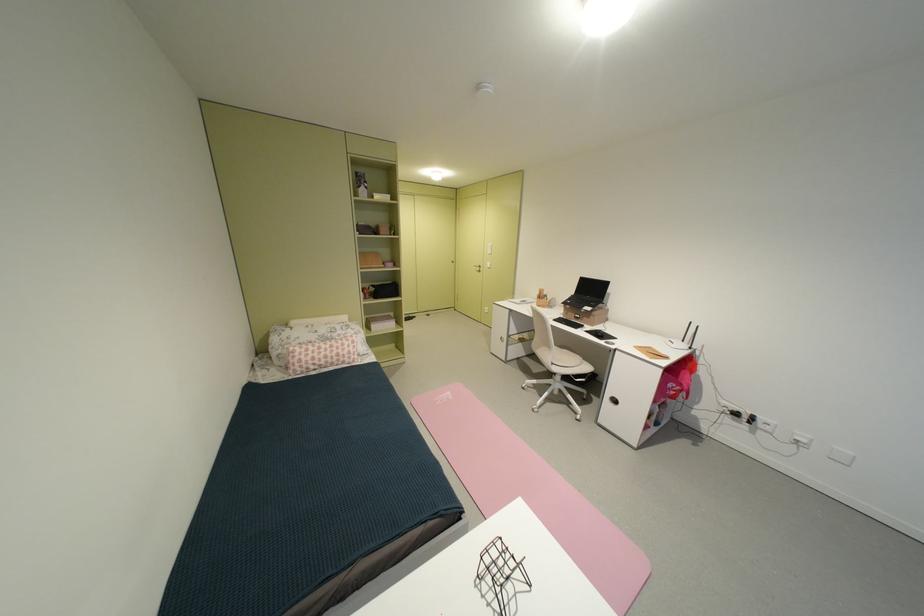
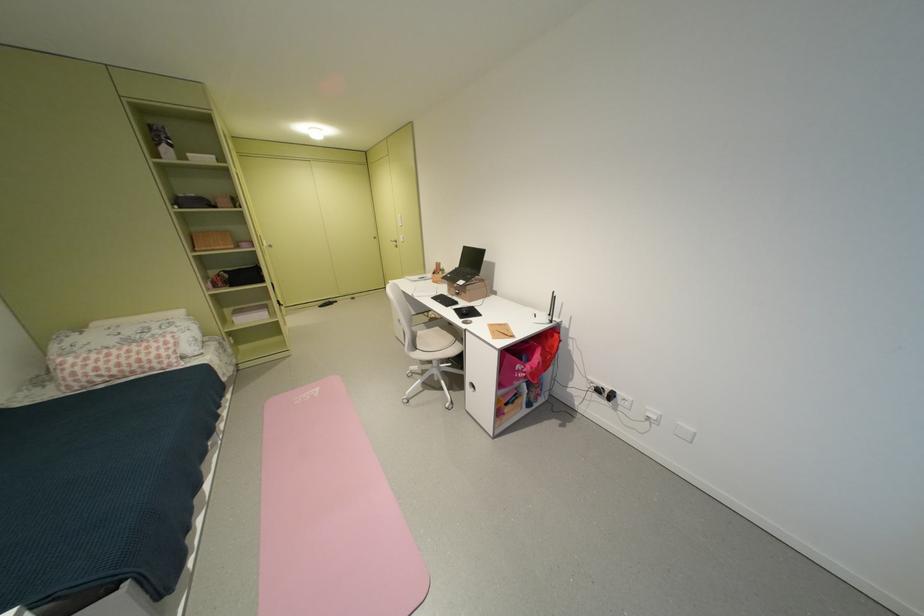
In the second image, find the point that corresponds to (x=554, y=300) in the first image.

(450, 274)